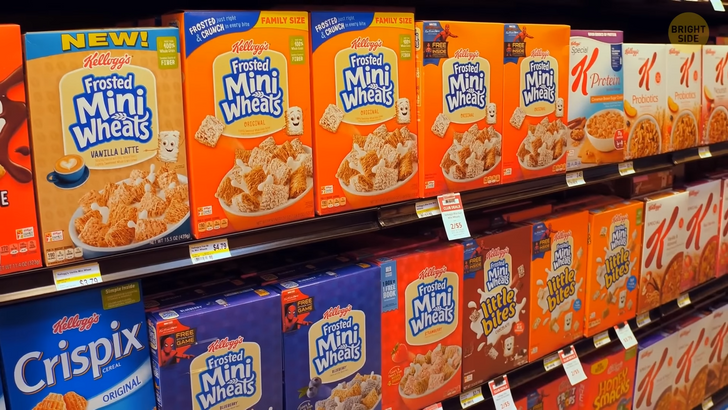
This screenshot has height=410, width=728. I want to click on cereals on the bottom shelf, so click(x=720, y=340), click(x=688, y=369), click(x=654, y=375), click(x=613, y=392), click(x=550, y=396), click(x=523, y=404).